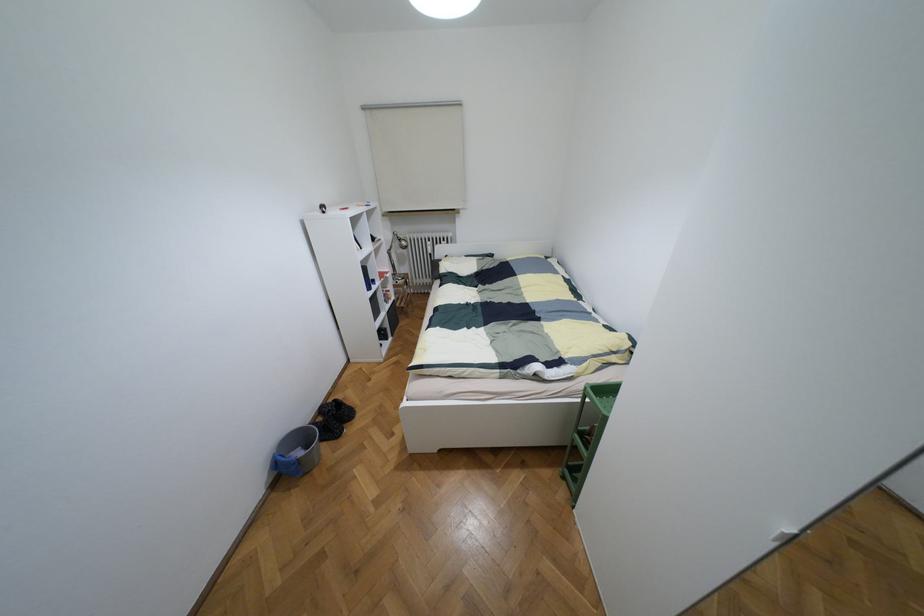
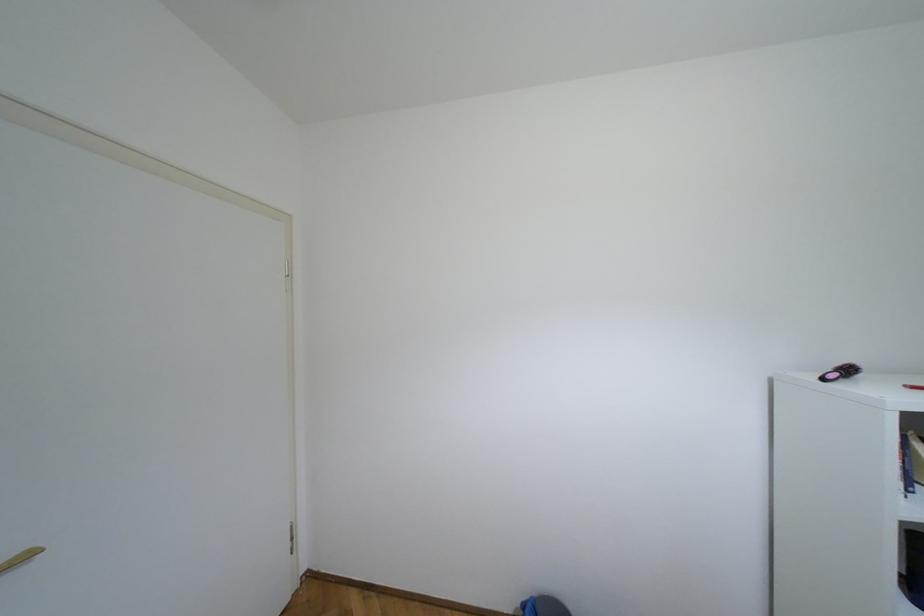
Question: How did the camera likely rotate?

Choices:
 (A) Left
 (B) Right
 (C) Up
 (D) Down

Answer: (A)